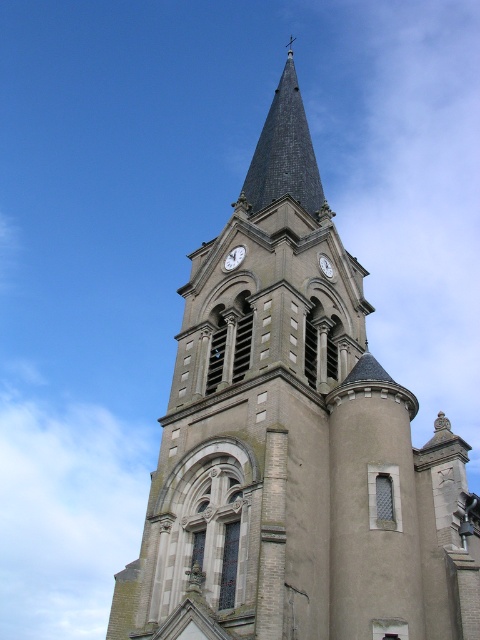
You are standing in front of the church and want to take a photo of the smooth stone clock tower at center and the white stone clock at upper center. Which object should you zoom in more on to ensure both are clearly visible in the photo?

You should zoom in more on the smooth stone clock tower at center because it is larger in size compared to the white stone clock at upper center, so adjusting the zoom to accommodate its size will help both appear clearly.

You are an architect inspecting the church tower. You notice the white stone clock at upper center and the white metallic clock at center. Which clock has a greater width?

The white stone clock at upper center might be wider than the white metallic clock at center according to the description provided.

You are standing in front of the church tower and notice two points marked on the tower. The first point is at coordinates point (321,476) and the second is at point (227,269). Which of these points is nearer to your current position?

Point (321,476) is closer to the camera than point (227,269), so the first point is nearer to your current position.